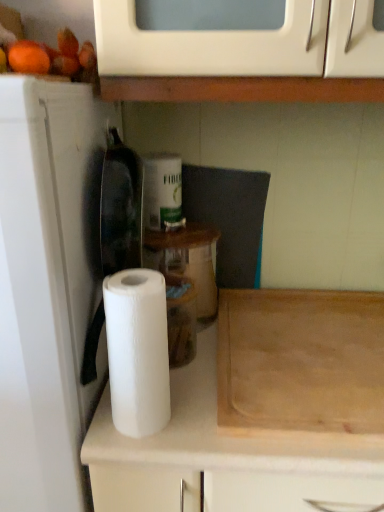
Question: Does wooden cutting board at lower right have a greater height compared to white paper towel at left?

Choices:
 (A) no
 (B) yes

Answer: (A)

Question: Does wooden cutting board at lower right come in front of white paper towel at left?

Choices:
 (A) yes
 (B) no

Answer: (B)

Question: Is white paper towel at left completely or partially inside wooden cutting board at lower right?

Choices:
 (A) no
 (B) yes

Answer: (A)

Question: Considering the relative positions of wooden cutting board at lower right and white paper towel at left in the image provided, is wooden cutting board at lower right to the right of white paper towel at left from the viewer's perspective?

Choices:
 (A) no
 (B) yes

Answer: (B)

Question: Can you confirm if wooden cutting board at lower right is positioned to the left of white paper towel at left?

Choices:
 (A) no
 (B) yes

Answer: (A)

Question: From the image's perspective, is white paper towel at left located above or below wooden cutting board at lower right?

Choices:
 (A) above
 (B) below

Answer: (B)

Question: Is white paper towel at left wider or thinner than wooden cutting board at lower right?

Choices:
 (A) thin
 (B) wide

Answer: (A)

Question: Is white paper towel at left bigger or smaller than wooden cutting board at lower right?

Choices:
 (A) big
 (B) small

Answer: (A)

Question: From a real-world perspective, is white paper towel at left above or below wooden cutting board at lower right?

Choices:
 (A) below
 (B) above

Answer: (A)

Question: Considering their positions, is wooden cutting board at lower right located in front of or behind white paper towel at left?

Choices:
 (A) front
 (B) behind

Answer: (B)

Question: Based on their positions, is wooden cutting board at lower right located to the left or right of white paper towel at left?

Choices:
 (A) right
 (B) left

Answer: (A)

Question: In terms of size, does wooden cutting board at lower right appear bigger or smaller than white paper towel at left?

Choices:
 (A) big
 (B) small

Answer: (B)

Question: Which is correct: wooden cutting board at lower right is inside white paper towel at left, or outside of it?

Choices:
 (A) inside
 (B) outside

Answer: (B)

Question: From a real-world perspective, relative to wooden cutting board at lower right, is white matte paper towel at center vertically above or below?

Choices:
 (A) above
 (B) below

Answer: (A)

Question: Is white matte paper towel at center in front of or behind wooden cutting board at lower right in the image?

Choices:
 (A) behind
 (B) front

Answer: (B)